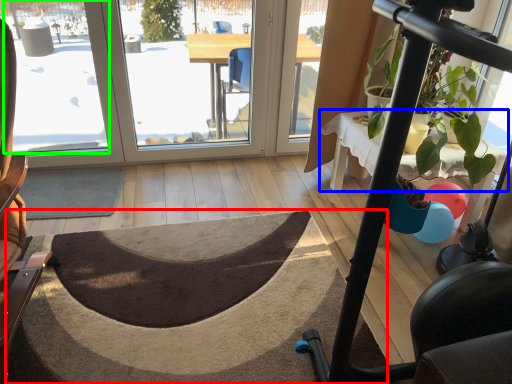
Question: Considering the real-world distances, which object is closest to doormat (highlighted by a red box)? table (highlighted by a blue box) or window screen (highlighted by a green box).

Choices:
 (A) table
 (B) window screen

Answer: (A)